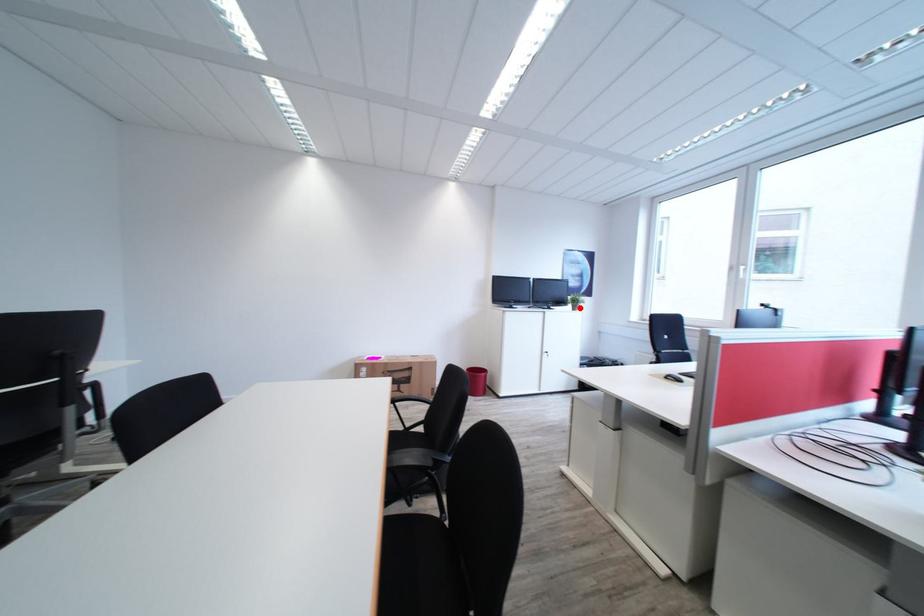
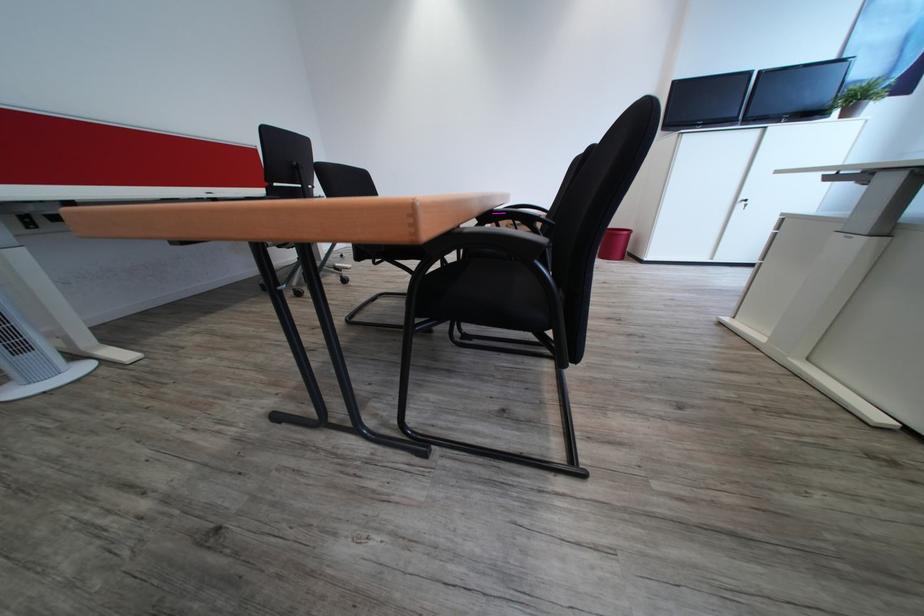
Question: I am providing you with two images of the same scene from different viewpoints. A red point is shown in image1. For the corresponding object point in image2, is it positioned nearer or farther from the camera?

Choices:
 (A) Nearer
 (B) Farther

Answer: (B)